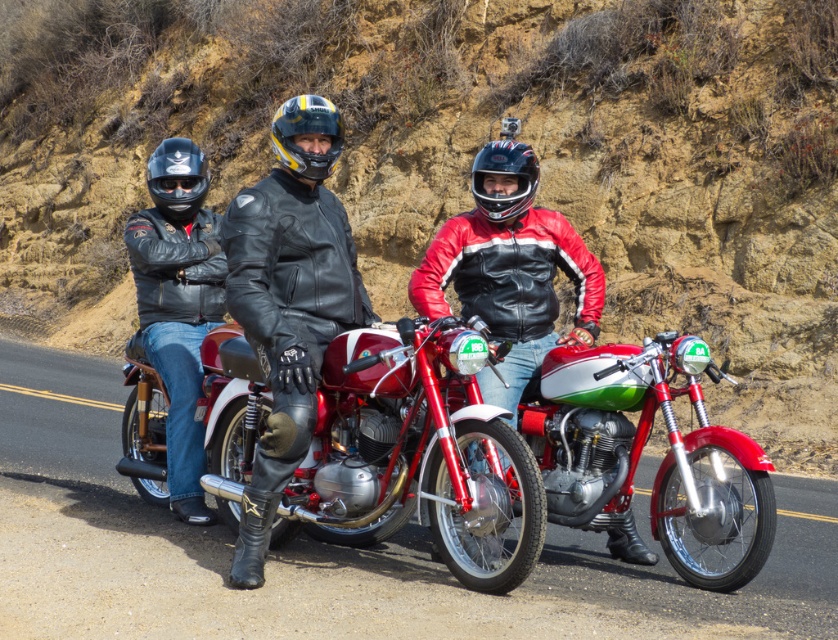
Which is behind, point (459, 572) or point (286, 321)?

Point (286, 321)

Which is in front, point (241, 436) or point (298, 202)?

Point (298, 202) is more forward.

Find the location of a particular element. shiny chrome motorcycle at center is located at coordinates (419, 452).

Does dull brown dirt at center appear on the left side of black leather jacket at center?

Indeed, dull brown dirt at center is positioned on the left side of black leather jacket at center.

Does dull brown dirt at center appear under black leather jacket at center?

No, dull brown dirt at center is not below black leather jacket at center.

Where is `dull brown dirt at center`? The image size is (838, 640). dull brown dirt at center is located at coordinates (459, 156).

Can you confirm if red leather jacket at center is positioned to the right of black matte helmet at center?

In fact, red leather jacket at center is to the left of black matte helmet at center.

Between red leather jacket at center and black matte helmet at center, which one is positioned lower?

red leather jacket at center is below.

Who is more forward, (520,349) or (476,157)?

Point (520,349) is more forward.

At what (x,y) coordinates should I click in order to perform the action: click on red leather jacket at center. Please return your answer as a coordinate pair (x, y). The height and width of the screenshot is (640, 838). Looking at the image, I should click on (510, 269).